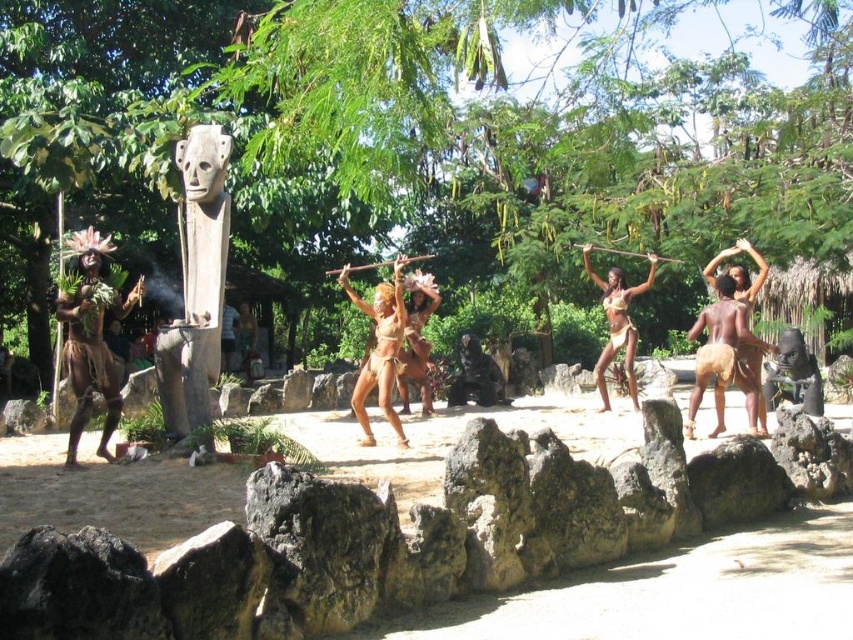
You are a photographer trying to capture the entire scene in one shot. The statue in the center has two distinct features visible from your angle. Which of the two features, the brown textured skin at center or the brown leather skirt at center, appears wider in the image?

The brown textured skin at center appears wider than the brown leather skirt at center in the image.

You are a photographer positioned at the edge of the sandy area. You need to capture a photo that includes both the brown textured grass skirt at left and the brown textured skin at center. Based on their positions, which object should you adjust your camera angle to focus on first to ensure both are in frame?

The brown textured grass skirt at left is to the left of brown textured skin at center, so you should focus on the brown textured grass skirt at left first to ensure it stays in frame while adjusting for the center object.

You are standing at the center of the scene and want to move towards the statue. There are two points marked in the image, point 1 at coordinates point (74, 378) and point 2 at coordinates point (614, 346). Which point should you walk towards to get closer to the statue?

Point 1 at coordinates point (74, 378) is in front of point 2 at coordinates point (614, 346), so walking towards point 1 would bring you closer to the statue.